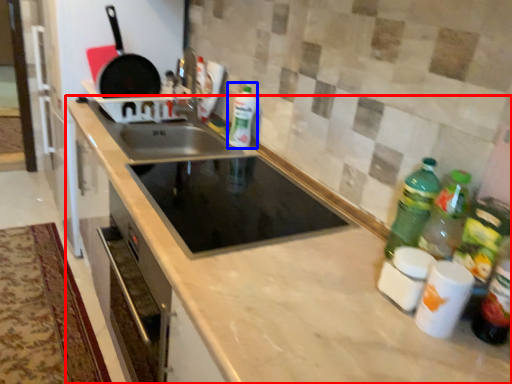
Question: Which object appears farthest to the camera in this image, countertop (highlighted by a red box) or bottle (highlighted by a blue box)?

Choices:
 (A) countertop
 (B) bottle

Answer: (B)